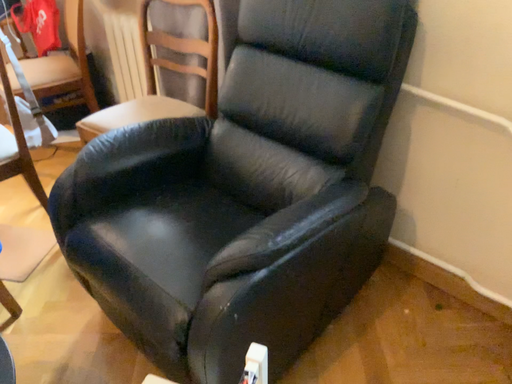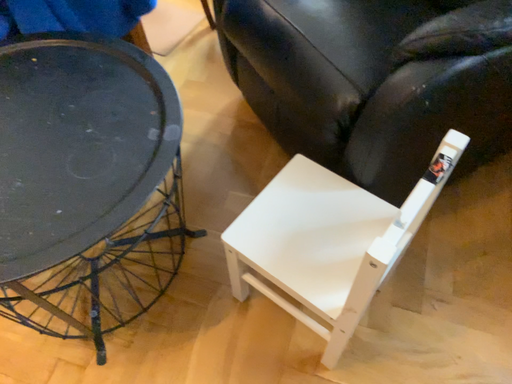
Question: Which way did the camera rotate in the video?

Choices:
 (A) rotated left
 (B) rotated right

Answer: (A)